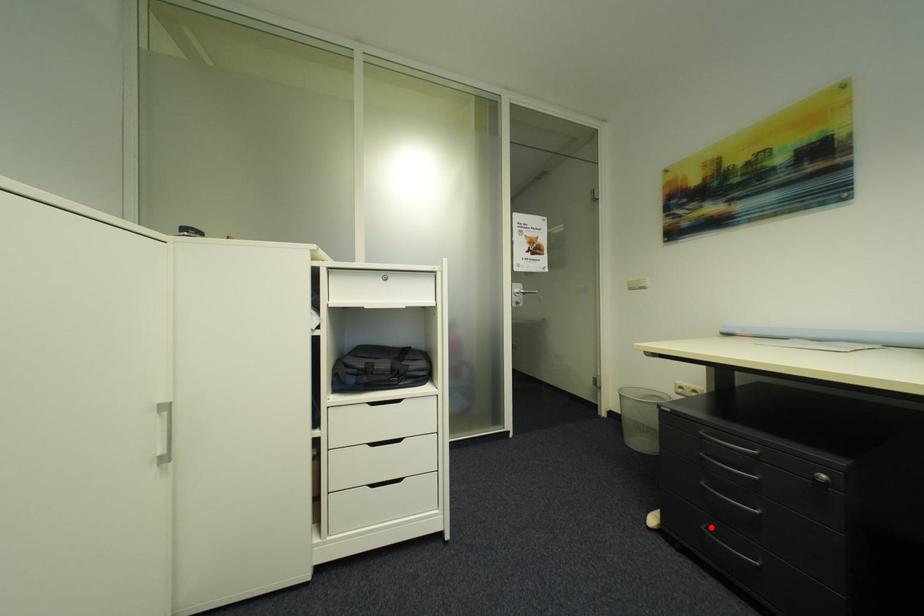
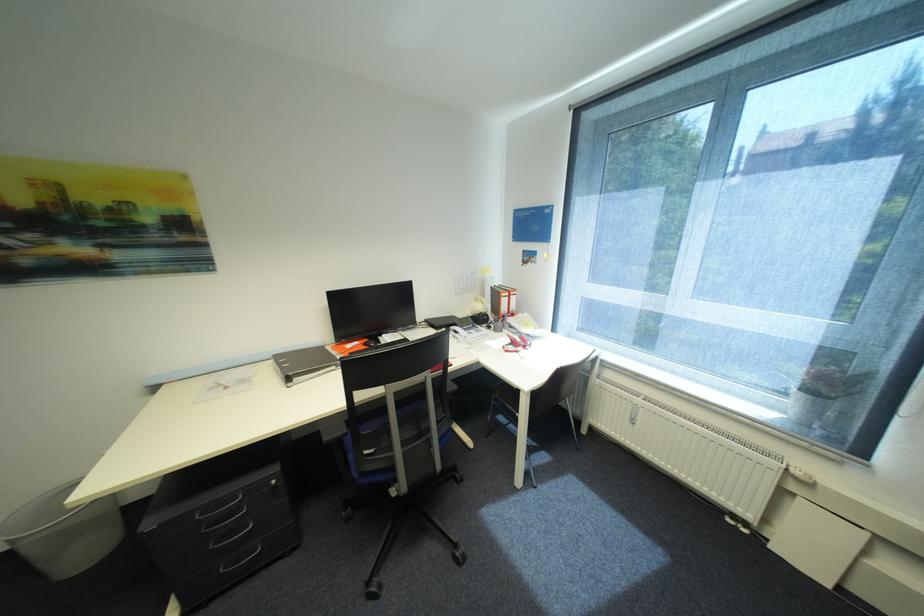
Where in the second image is the point corresponding to the highlighted location from the first image?

(229, 570)